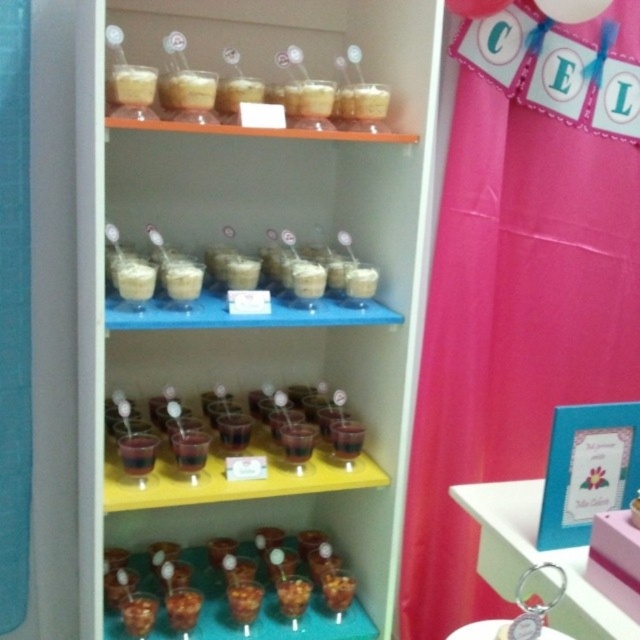
You are standing in front of the display cabinet and want to reach the point at coordinates [364,307]. If your arm can extend 4 feet, can you reach it?

The point at [364,307] is 5.12 feet away from the viewer, which is beyond the 4 feet reach of your arm. Therefore, you cannot reach it.

You are a customer at a dessert shop and see the translucent glass cups at center and the pink glossy keychain at lower right. Which item is positioned higher in the display?

The translucent glass cups at center are positioned higher than the pink glossy keychain at lower right because the translucent glass cups at center is located above the pink glossy keychain at lower right.

You are a customer at a dessert shop and see the translucent glass cups at center and the pink glossy keychain at lower right displayed in the cabinet. Which item takes up more space in the display?

The translucent glass cups at center are bigger than the pink glossy keychain at lower right, so they take up more space in the display.